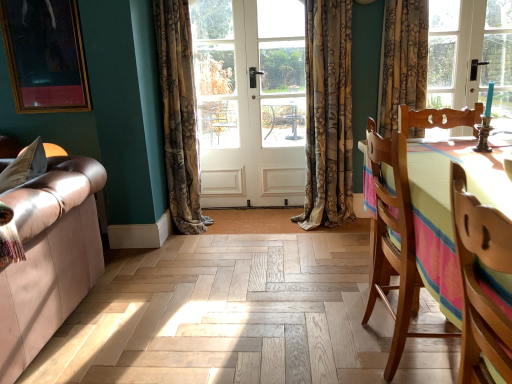
Question: Is wooden chair at right, which is counted as the second chair, starting from the front, oriented away from floral fabric curtain at center, acting as the second curtain starting from the left?

Choices:
 (A) no
 (B) yes

Answer: (A)

Question: From the image's perspective, would you say wooden chair at right, the first chair positioned from the back, is shown under floral fabric curtain at center, the 1th curtain from the right?

Choices:
 (A) no
 (B) yes

Answer: (B)

Question: From a real-world perspective, does wooden chair at right, which is counted as the second chair, starting from the front, stand above floral fabric curtain at center, the 1th curtain from the right?

Choices:
 (A) yes
 (B) no

Answer: (B)

Question: Is wooden chair at right, the first chair positioned from the back, positioned before floral fabric curtain at center, the 1th curtain from the right?

Choices:
 (A) yes
 (B) no

Answer: (A)

Question: Are wooden chair at right, which is counted as the second chair, starting from the front, and floral fabric curtain at center, acting as the second curtain starting from the left, far apart?

Choices:
 (A) no
 (B) yes

Answer: (B)

Question: Considering the relative sizes of wooden chair at right, the first chair positioned from the back, and floral fabric curtain at center, acting as the second curtain starting from the left, in the image provided, is wooden chair at right, the first chair positioned from the back, smaller than floral fabric curtain at center, acting as the second curtain starting from the left,?

Choices:
 (A) yes
 (B) no

Answer: (B)

Question: Is the position of floral fabric curtain at center, the second curtain when ordered from right to left, more distant than that of gold-framed portrait at upper left?

Choices:
 (A) yes
 (B) no

Answer: (B)

Question: Does floral fabric curtain at center, the second curtain when ordered from right to left, have a larger size compared to gold-framed portrait at upper left?

Choices:
 (A) yes
 (B) no

Answer: (A)

Question: From a real-world perspective, is floral fabric curtain at center, the second curtain when ordered from right to left, located higher than gold-framed portrait at upper left?

Choices:
 (A) yes
 (B) no

Answer: (B)

Question: Is floral fabric curtain at center, the second curtain when ordered from right to left, shorter than gold-framed portrait at upper left?

Choices:
 (A) yes
 (B) no

Answer: (B)

Question: Is floral fabric curtain at center, the 1th curtain in the left-to-right sequence, taller than gold-framed portrait at upper left?

Choices:
 (A) no
 (B) yes

Answer: (B)

Question: Does floral fabric curtain at center, the second curtain when ordered from right to left, have a greater width compared to gold-framed portrait at upper left?

Choices:
 (A) no
 (B) yes

Answer: (B)

Question: Is gold-framed portrait at upper left not close to wooden chair at right, the second chair viewed from the back?

Choices:
 (A) no
 (B) yes

Answer: (B)